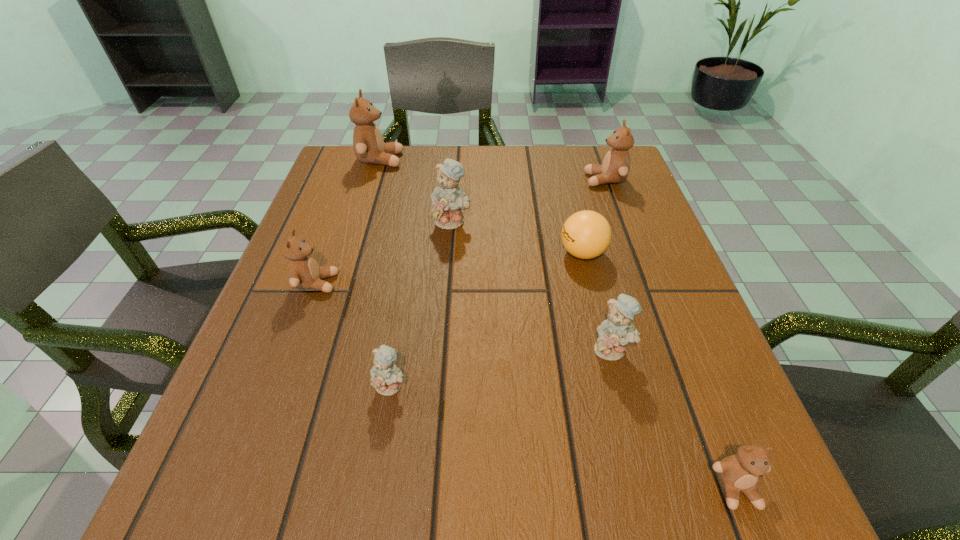
The height and width of the screenshot is (540, 960). I want to click on free space between the biggest brown teddy bear and the third smallest brown teddy bear, so click(492, 170).

Identify the location of free point between the nearest teddy bear and the tallest object. (559, 324).

What are the coordinates of `free space between the third biggest brown teddy bear and the tallest teddy bear` in the screenshot? It's located at (348, 221).

The width and height of the screenshot is (960, 540). In order to click on empty space that is in between the ping-pong ball and the tallest teddy bear in this screenshot , I will do `click(481, 206)`.

You are a GUI agent. You are given a task and a screenshot of the screen. Output one action in this format:
    pyautogui.click(x=<x>, y=<y>)
    Task: Click on the vacant area between the nearest teddy bear and the fifth teddy bear from left to right
    Image resolution: width=960 pixels, height=540 pixels.
    Given the screenshot: What is the action you would take?
    pyautogui.click(x=674, y=418)

Choose which object is the second nearest neighbor to the fourth nearest teddy bear. Please provide its 2D coordinates. Your answer should be formatted as a tuple, i.e. [(x, y)], where the tuple contains the x and y coordinates of a point satisfying the conditions above.

[(448, 199)]

Identify which object is the third closest to the fourth teddy bear from right to left. Please provide its 2D coordinates. Your answer should be formatted as a tuple, i.e. [(x, y)], where the tuple contains the x and y coordinates of a point satisfying the conditions above.

[(303, 270)]

Find the location of a particular element. teddy bear that is the sixth closest to the ping-pong ball is located at coordinates (303, 270).

At what (x,y) coordinates should I click in order to perform the action: click on teddy bear identified as the closest to the second biggest brown teddy bear. Please return your answer as a coordinate pair (x, y). This screenshot has height=540, width=960. Looking at the image, I should click on coord(448,199).

You are a GUI agent. You are given a task and a screenshot of the screen. Output one action in this format:
    pyautogui.click(x=<x>, y=<y>)
    Task: Click on the brown teddy bear that is the second nearest to the fourth farthest teddy bear
    Image resolution: width=960 pixels, height=540 pixels.
    Given the screenshot: What is the action you would take?
    pyautogui.click(x=615, y=168)